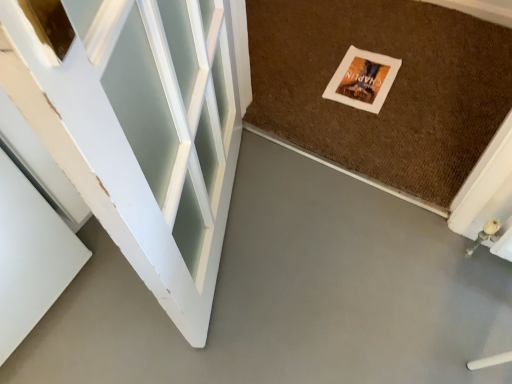
Locate an element on the screen. The width and height of the screenshot is (512, 384). vacant point above matte paper postcard at center (from a real-world perspective) is located at coordinates (366, 77).